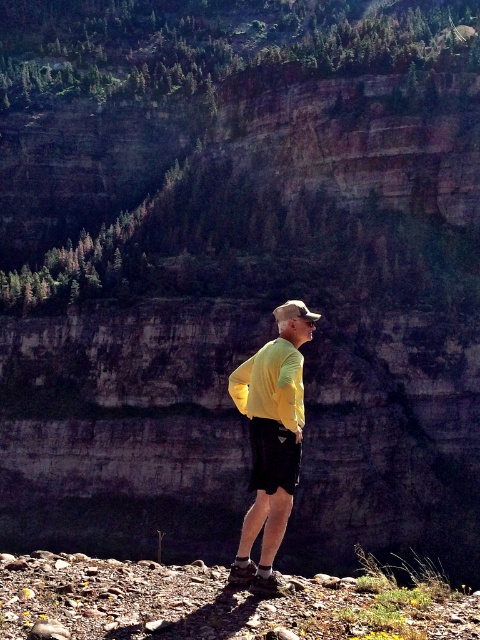
Question: Does yellow matte shirt at center have a lesser width compared to black cotton shorts at lower center?

Choices:
 (A) no
 (B) yes

Answer: (A)

Question: Which object is positioned farthest from the yellow matte shirt at center?

Choices:
 (A) camouflage fabric baseball cap at center
 (B) black cotton shorts at lower center

Answer: (A)

Question: Does yellow matte shirt at center have a larger size compared to camouflage fabric baseball cap at center?

Choices:
 (A) no
 (B) yes

Answer: (B)

Question: Which of the following is the farthest from the observer?

Choices:
 (A) camouflage fabric baseball cap at center
 (B) black cotton shorts at lower center
 (C) yellow matte shirt at center

Answer: (A)

Question: Which of these objects is positioned closest to the black cotton shorts at lower center?

Choices:
 (A) yellow matte shirt at center
 (B) camouflage fabric baseball cap at center

Answer: (A)

Question: Can you confirm if black cotton shorts at lower center is smaller than camouflage fabric baseball cap at center?

Choices:
 (A) no
 (B) yes

Answer: (A)